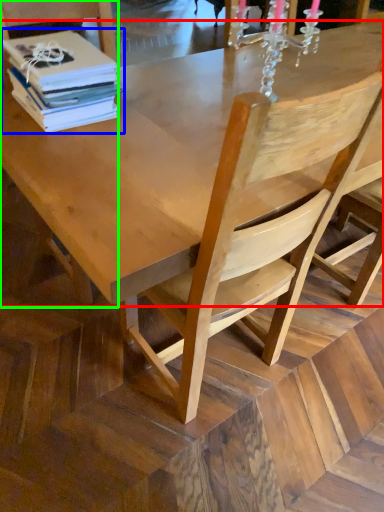
Question: Based on their relative distances, which object is farther from round table (highlighted by a red box)? Choose from book (highlighted by a blue box) and chair (highlighted by a green box).

Choices:
 (A) book
 (B) chair

Answer: (B)